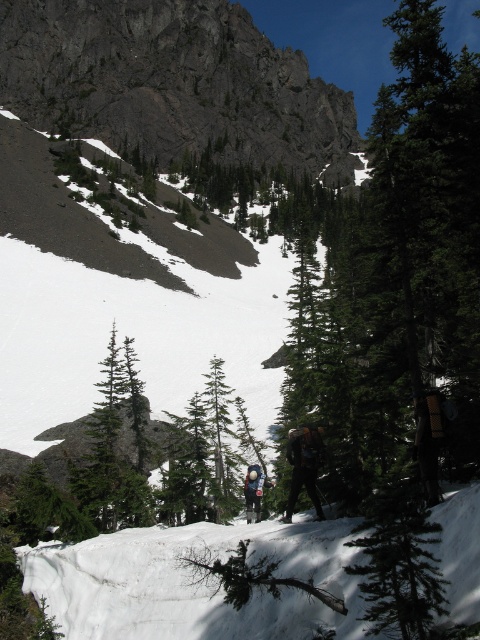
You are a hiker planning to reach a specific point marked at coordinates point [51,67] in this mountain landscape. Given that your hiking pace is 3 miles per hour, how long will it take you to reach that point from your current position?

The distance to point [51,67] is 417.00 feet. Converting this to miles, 417 feet is approximately 0.08 miles. At a pace of 3 miles per hour, the time required would be distance divided by speed, so 0.08 miles divided by 3 mph equals roughly 0.027 hours. Multiplying by 60 gives approximately 1.6 minutes. Therefore, it would take about 2 minutes to reach the point.

You are a hiker planning to carry both the dark green fabric jacket at center and the blue fabric backpack at center. If you want to ensure they both fit in your storage compartment, which one requires more space horizontally?

The dark green fabric jacket at center might be wider than the blue fabric backpack at center, so it requires more horizontal space.

You are a hiker trying to reach the summit of the rugged granite mountain at upper center. There is a point marked at coordinates point (172,83). Is this point located on the rugged granite mountain at upper center?

Yes, the point (172,83) is on the rugged granite mountain at upper center, so it is part of the mountain you are trying to reach.